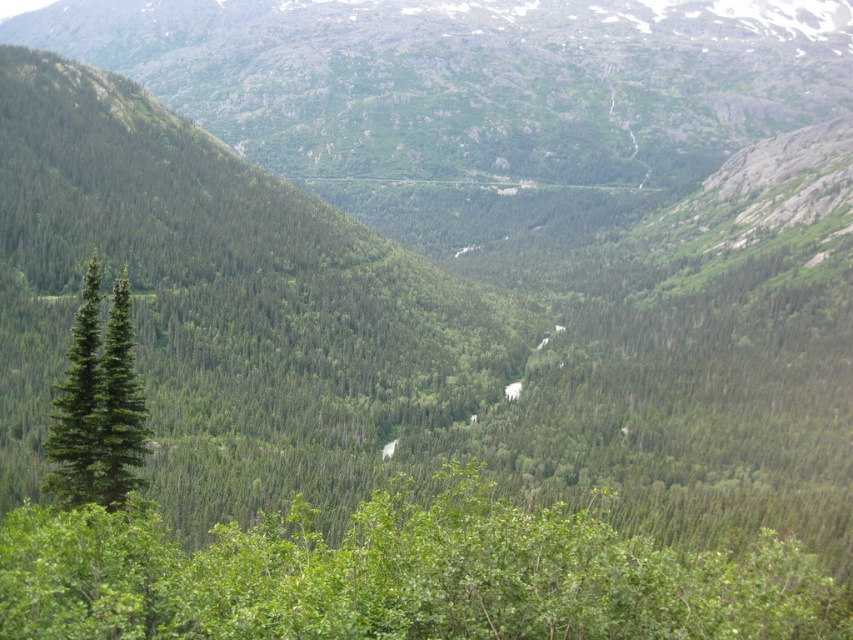
Does green leafy tree at lower left have a smaller size compared to green matte tree at left?

No.

Between green leafy tree at lower left and green matte tree at left, which one has more height?

green matte tree at left is taller.

Describe the element at coordinates (399, 576) in the screenshot. The width and height of the screenshot is (853, 640). I see `green leafy tree at lower left` at that location.

The width and height of the screenshot is (853, 640). I want to click on green leafy tree at lower left, so click(x=399, y=576).